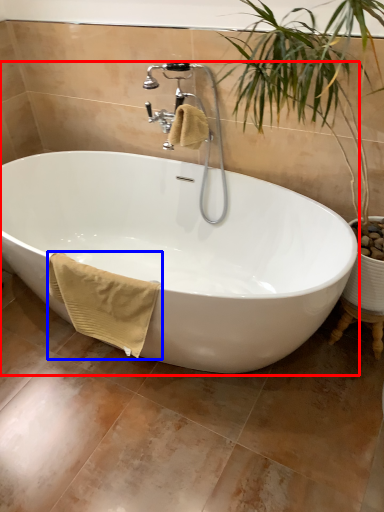
Question: Which object appears farthest to the camera in this image, bathtub (highlighted by a red box) or bath towel (highlighted by a blue box)?

Choices:
 (A) bathtub
 (B) bath towel

Answer: (B)